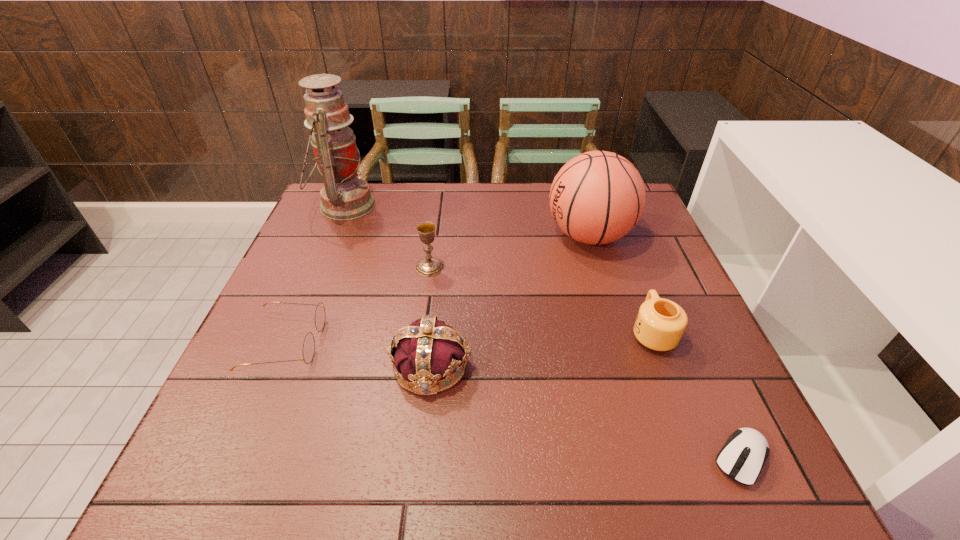
Where is `blank region between the second tallest object and the third shortest object`? Image resolution: width=960 pixels, height=540 pixels. blank region between the second tallest object and the third shortest object is located at coordinates (620, 284).

At what (x,y) coordinates should I click in order to perform the action: click on free space between the mouse and the oil lamp. Please return your answer as a coordinate pair (x, y). This screenshot has width=960, height=540. Looking at the image, I should click on (543, 332).

Where is `unoccupied area between the oil lamp and the crown`? unoccupied area between the oil lamp and the crown is located at coordinates (388, 286).

Locate an element on the screen. The width and height of the screenshot is (960, 540). vacant space in between the nearest object and the crown is located at coordinates (587, 412).

Where is `object that is the second closest one to the tallest object`? object that is the second closest one to the tallest object is located at coordinates (309, 342).

Where is `object that stands as the third closest to the spectacles`? object that stands as the third closest to the spectacles is located at coordinates (344, 196).

The width and height of the screenshot is (960, 540). Identify the location of vacant space that satisfies the following two spatial constraints: 1. on the handle side of the mug; 2. on the surface of the basketball near the brand logo. (615, 235).

Where is `blank space that satisfies the following two spatial constraints: 1. on the front side of the chalice; 2. on the right side of the tallest object`? blank space that satisfies the following two spatial constraints: 1. on the front side of the chalice; 2. on the right side of the tallest object is located at coordinates (320, 267).

Find the location of a particular element. This screenshot has width=960, height=540. free space that satisfies the following two spatial constraints: 1. on the surface of the basketball near the brand logo; 2. on the handle side of the mug is located at coordinates (618, 333).